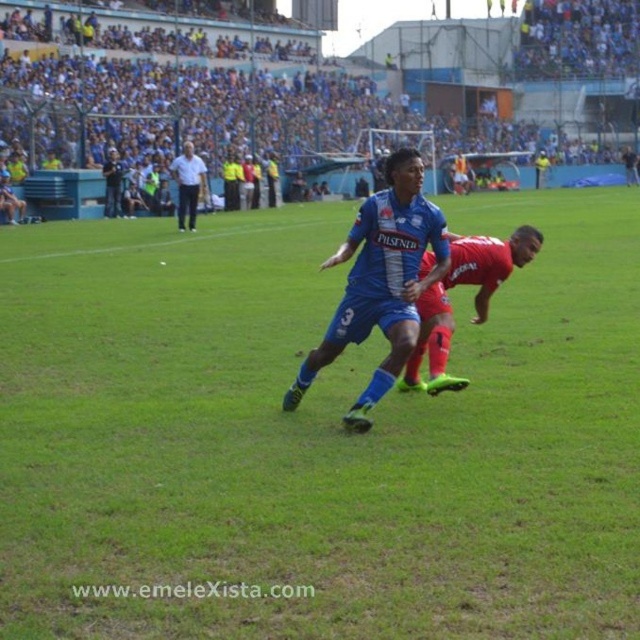
Question: Can you confirm if blue fabric soccer player at center is positioned to the right of blue jersey at center?

Choices:
 (A) yes
 (B) no

Answer: (A)

Question: Which object appears farthest from the camera in this image?

Choices:
 (A) blue fabric soccer player at center
 (B) shiny red shorts at center
 (C) white cotton shirt at upper center

Answer: (C)

Question: Considering the real-world distances, which object is farthest from the white cotton shirt at upper center?

Choices:
 (A) blue jersey at center
 (B) blue fabric soccer player at center
 (C) shiny red shorts at center

Answer: (C)

Question: Can you confirm if shiny red shorts at center is wider than white cotton shirt at upper center?

Choices:
 (A) yes
 (B) no

Answer: (B)

Question: Which object is positioned closest to the blue fabric soccer player at center?

Choices:
 (A) shiny red shorts at center
 (B) white cotton shirt at upper center

Answer: (A)

Question: Does blue fabric soccer player at center appear under shiny red shorts at center?

Choices:
 (A) no
 (B) yes

Answer: (A)